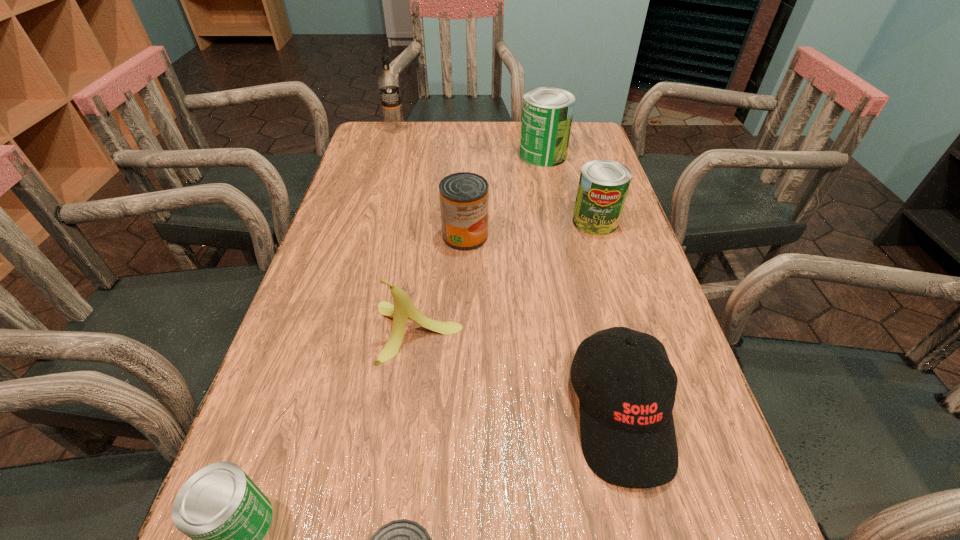
At what (x,y) coordinates should I click in order to perform the action: click on vacant space at the left edge of the desktop. Please return your answer as a coordinate pair (x, y). Looking at the image, I should click on (357, 230).

Where is `vacant area at the right edge`? This screenshot has width=960, height=540. vacant area at the right edge is located at coordinates (575, 228).

I want to click on vacant point located between the baseball cap and the banana, so click(519, 373).

At what (x,y) coordinates should I click in order to perform the action: click on free point between the banana and the bigger red can. Please return your answer as a coordinate pair (x, y). Looking at the image, I should click on (442, 284).

Locate an element on the screen. free space between the vodka and the black baseball cap is located at coordinates (508, 271).

Find the location of a particular element. This screenshot has width=960, height=540. empty space between the bigger red can and the farthest can is located at coordinates (504, 195).

You are a GUI agent. You are given a task and a screenshot of the screen. Output one action in this format:
    pyautogui.click(x=<x>, y=<y>)
    Task: Click on the vacant area between the farthest can and the farthest object
    This screenshot has width=960, height=540.
    Given the screenshot: What is the action you would take?
    tap(469, 142)

At what (x,y) coordinates should I click in order to perform the action: click on empty location between the tallest object and the baseball cap. Please return your answer as a coordinate pair (x, y). Image resolution: width=960 pixels, height=540 pixels. Looking at the image, I should click on (508, 271).

At what (x,y) coordinates should I click in order to perform the action: click on object that is the sixth nearest to the banana. Please return your answer as a coordinate pair (x, y). The image size is (960, 540). Looking at the image, I should click on (547, 113).

Locate an element on the screen. object that is the fifth closest to the banana is located at coordinates (603, 185).